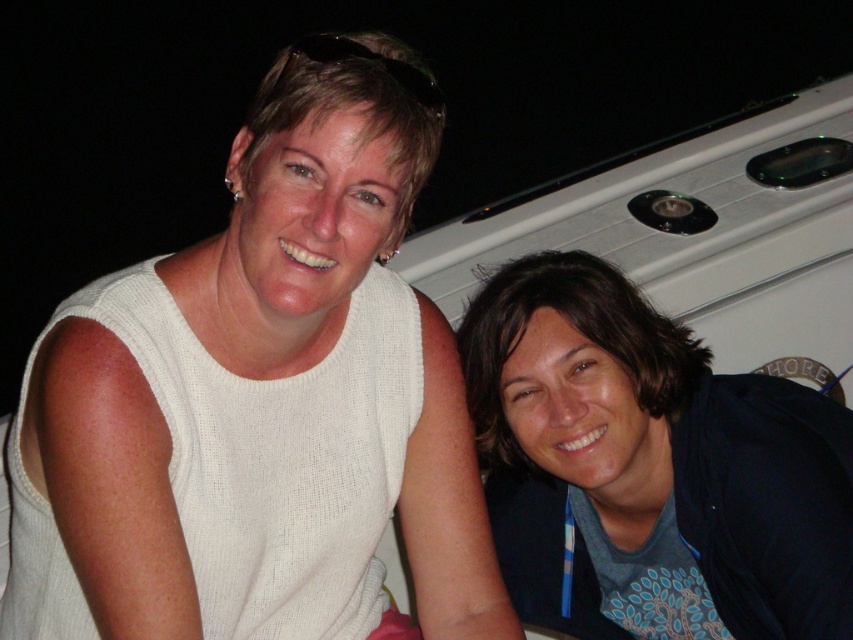
Question: Which point appears farthest from the camera in this image?

Choices:
 (A) (706, 618)
 (B) (200, 545)

Answer: (A)

Question: Which point is farther from the camera taking this photo?

Choices:
 (A) coord(712,474)
 (B) coord(401,84)

Answer: (A)

Question: Can you confirm if white knitted sweater at upper left is positioned to the left of dark blue fabric at lower right?

Choices:
 (A) yes
 (B) no

Answer: (A)

Question: Considering the relative positions of white knitted sweater at upper left and dark blue fabric at lower right in the image provided, where is white knitted sweater at upper left located with respect to dark blue fabric at lower right?

Choices:
 (A) above
 (B) below

Answer: (A)

Question: Is the position of white knitted sweater at upper left more distant than that of dark blue fabric at lower right?

Choices:
 (A) no
 (B) yes

Answer: (A)